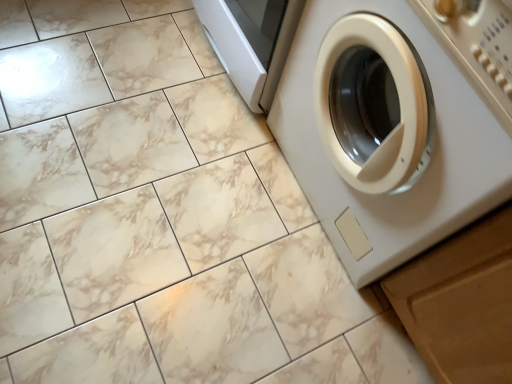
Question: Is there a large distance between wooden drawer at lower right and white glossy washing machine at right?

Choices:
 (A) no
 (B) yes

Answer: (A)

Question: From the image's perspective, is wooden drawer at lower right above white glossy washing machine at right?

Choices:
 (A) yes
 (B) no

Answer: (B)

Question: Is wooden drawer at lower right further to camera compared to white glossy washing machine at right?

Choices:
 (A) no
 (B) yes

Answer: (B)

Question: Can you confirm if wooden drawer at lower right is smaller than white glossy washing machine at right?

Choices:
 (A) no
 (B) yes

Answer: (B)

Question: From a real-world perspective, is wooden drawer at lower right on top of white glossy washing machine at right?

Choices:
 (A) no
 (B) yes

Answer: (A)

Question: From a real-world perspective, is wooden drawer at lower right beneath white glossy washing machine at right?

Choices:
 (A) yes
 (B) no

Answer: (A)

Question: From a real-world perspective, is white glossy washing machine at right physically above wooden drawer at lower right?

Choices:
 (A) yes
 (B) no

Answer: (A)

Question: Considering the relative positions of white glossy washing machine at right and wooden drawer at lower right in the image provided, is white glossy washing machine at right behind wooden drawer at lower right?

Choices:
 (A) no
 (B) yes

Answer: (A)

Question: Does white glossy washing machine at right turn towards wooden drawer at lower right?

Choices:
 (A) no
 (B) yes

Answer: (A)

Question: Is white glossy washing machine at right smaller than wooden drawer at lower right?

Choices:
 (A) yes
 (B) no

Answer: (B)

Question: Is white glossy washing machine at right wider than wooden drawer at lower right?

Choices:
 (A) yes
 (B) no

Answer: (A)

Question: Can you confirm if white glossy washing machine at right is positioned to the right of wooden drawer at lower right?

Choices:
 (A) yes
 (B) no

Answer: (B)

Question: Is white glossy washing machine at right bigger or smaller than wooden drawer at lower right?

Choices:
 (A) small
 (B) big

Answer: (B)